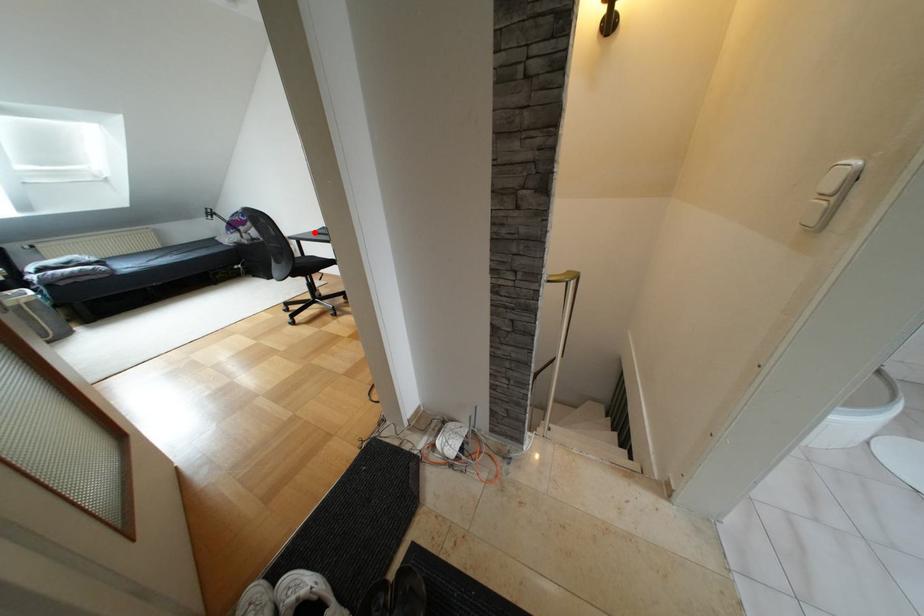
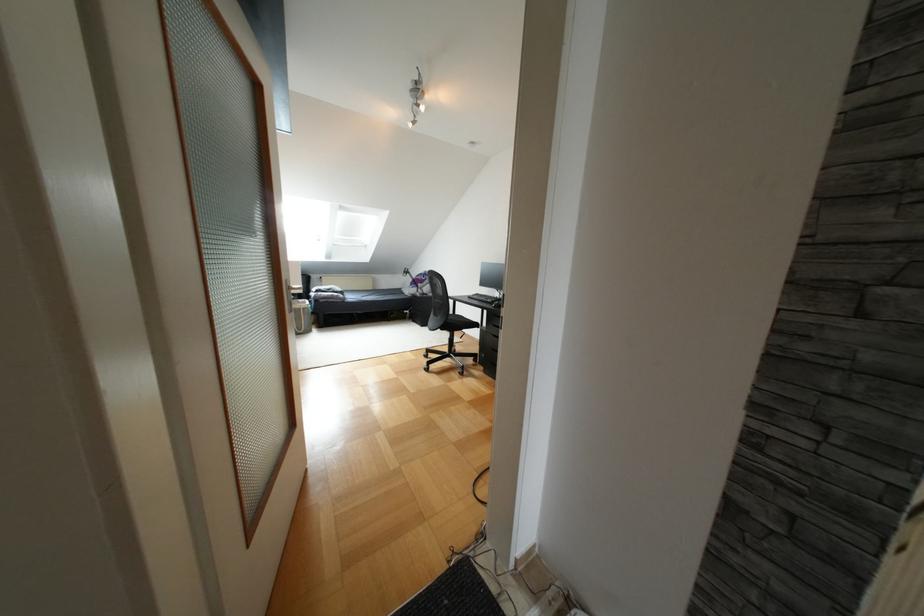
Question: A red point is marked in image1. In image2, is the corresponding 3D point closer to the camera or farther? Reply with the corresponding letter.

Choices:
 (A) The corresponding 3D point is closer.
 (B) The corresponding 3D point is farther.

Answer: (B)